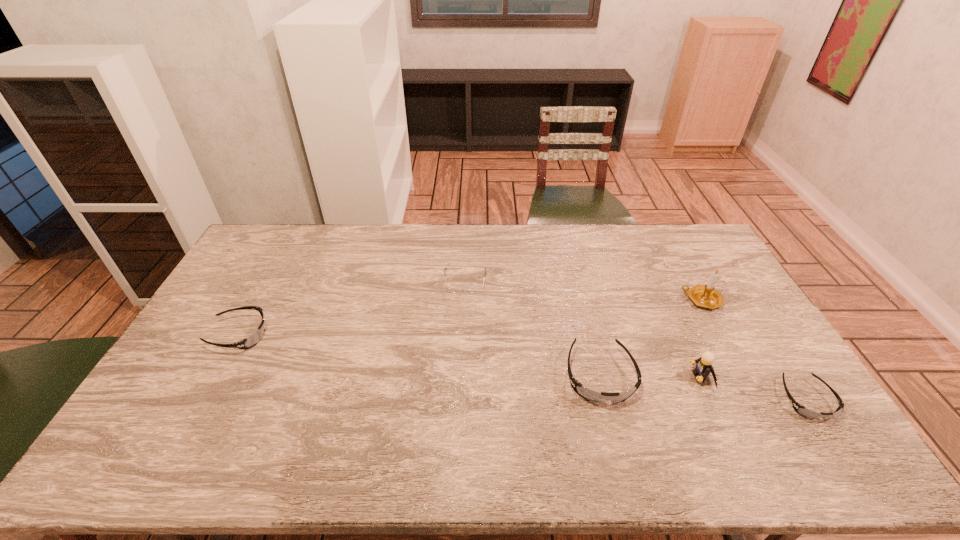
Find the location of `vacant region between the Lego and the third object from left to right`. vacant region between the Lego and the third object from left to right is located at coordinates (650, 376).

The width and height of the screenshot is (960, 540). I want to click on free space between the rightmost object and the second tallest object, so click(754, 388).

What are the coordinates of `vacant point located between the rightmost object and the fourth shortest object` in the screenshot? It's located at [703, 388].

Identify the location of free space that is in between the fifth object from right to left and the tallest object. This screenshot has width=960, height=540. (584, 290).

What are the coordinates of `free space between the second sunglasses from left to right and the leftmost sunglasses` in the screenshot? It's located at (420, 355).

Find the location of a particular element. The image size is (960, 540). vacant space that is in between the candle holder and the third tallest object is located at coordinates (651, 338).

Image resolution: width=960 pixels, height=540 pixels. Identify the location of free area in between the second object from left to right and the fourth object from left to right. (583, 328).

Where is `free point between the Lego and the shortest sunglasses`? free point between the Lego and the shortest sunglasses is located at coordinates (754, 388).

Find the location of a particular element. object that is the second closest one to the fifth object from left to right is located at coordinates (801, 410).

The width and height of the screenshot is (960, 540). Identify the location of object that is the closest to the Lego. (588, 394).